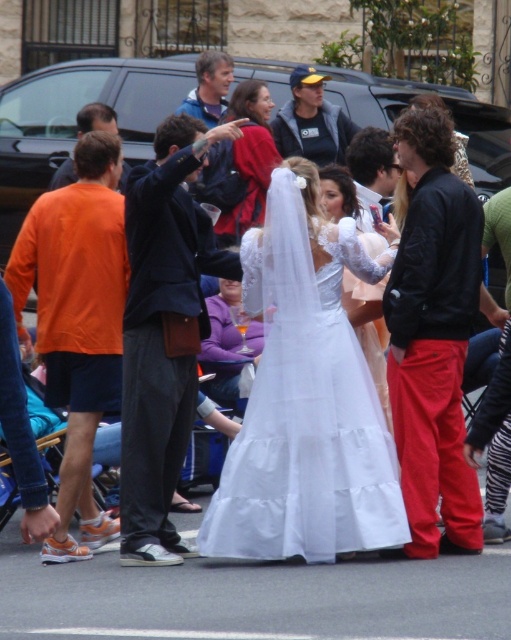
You are standing at the point with coordinates point (244, 141) and want to move to the point with coordinates point (413, 529). Is the point you want to reach located in front of you or behind you?

The point (413, 529) is in front of point (244, 141), so the point you want to reach is located in front of you.

You are a photographer at the event and want to ensure both the red cotton pants at center and the white satin dress at center are clearly visible in your photo. Given their sizes, which one might require more space in the frame to capture fully?

The red cotton pants at center has a larger size compared to the white satin dress at center, so it would require more space in the frame to be fully captured.